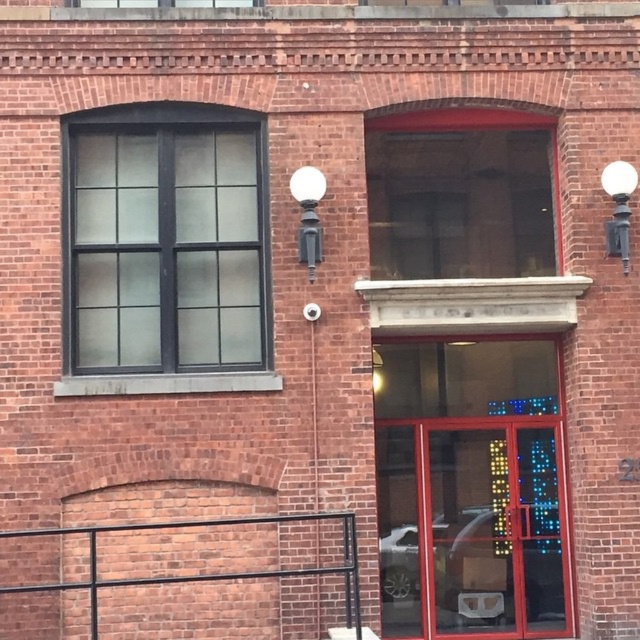
Does point (308, 268) come behind point (621, 218)?

No, it is not.

Does white glossy streetlamp at upper center appear over white glossy streetlamp at upper right?

Incorrect, white glossy streetlamp at upper center is not positioned above white glossy streetlamp at upper right.

Between point (317, 250) and point (614, 196), which one is positioned behind?

Point (614, 196)

At what (x,y) coordinates should I click in order to perform the action: click on white glossy streetlamp at upper center. Please return your answer as a coordinate pair (x, y). This screenshot has height=640, width=640. Looking at the image, I should click on (308, 214).

Who is positioned more to the left, black glass window at upper left or white glossy streetlamp at upper right?

From the viewer's perspective, black glass window at upper left appears more on the left side.

Which of these two, black glass window at upper left or white glossy streetlamp at upper right, stands taller?

black glass window at upper left is taller.

This screenshot has height=640, width=640. I want to click on black glass window at upper left, so click(163, 252).

Identify the location of black glass window at upper left. This screenshot has height=640, width=640. (163, 252).

Which is below, black glass window at upper left or white glossy streetlamp at upper center?

Answer: black glass window at upper left

Who is taller, black glass window at upper left or white glossy streetlamp at upper center?

Standing taller between the two is black glass window at upper left.

Who is more forward, (122, 220) or (300, 176)?

Point (300, 176) is in front.

At what (x,y) coordinates should I click in order to perform the action: click on black glass window at upper left. Please return your answer as a coordinate pair (x, y). Image resolution: width=640 pixels, height=640 pixels. Looking at the image, I should click on (163, 252).